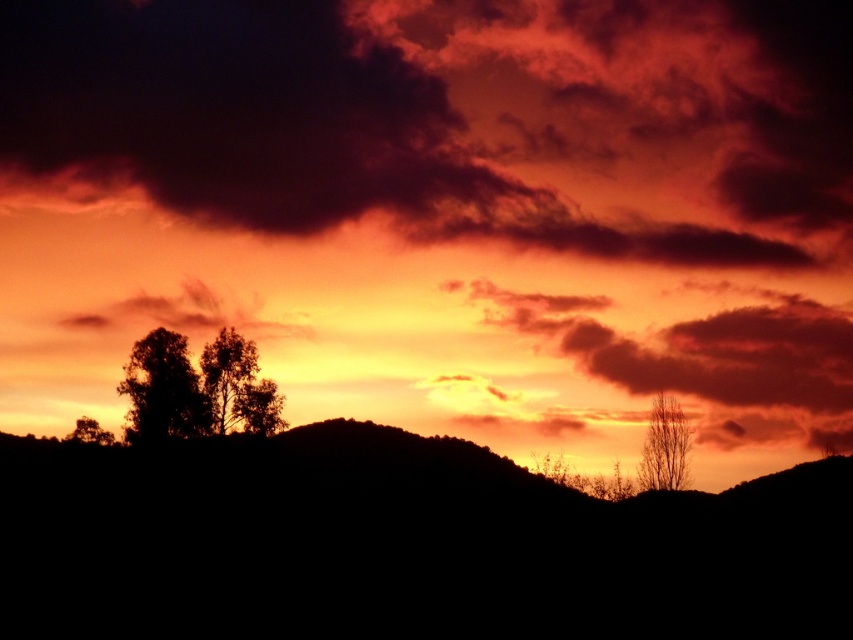
You are an artist trying to paint the sunset scene. You notice the dark red cloud at upper center and the bare branches at right. Which object should you paint first if you want to follow the rule of painting larger objects before smaller ones?

You should paint the dark red cloud at upper center first because it is larger in size than the bare branches at right.

Based on the photo, you are standing in the sunset scene and want to walk from the point at coordinates point (212,390) to the point at coordinates point (683,426). Which direction should you face to move towards the latter point?

Since point (212,390) is closer to the viewer than point (683,426), you should face away from the viewer to move towards point (683,426).